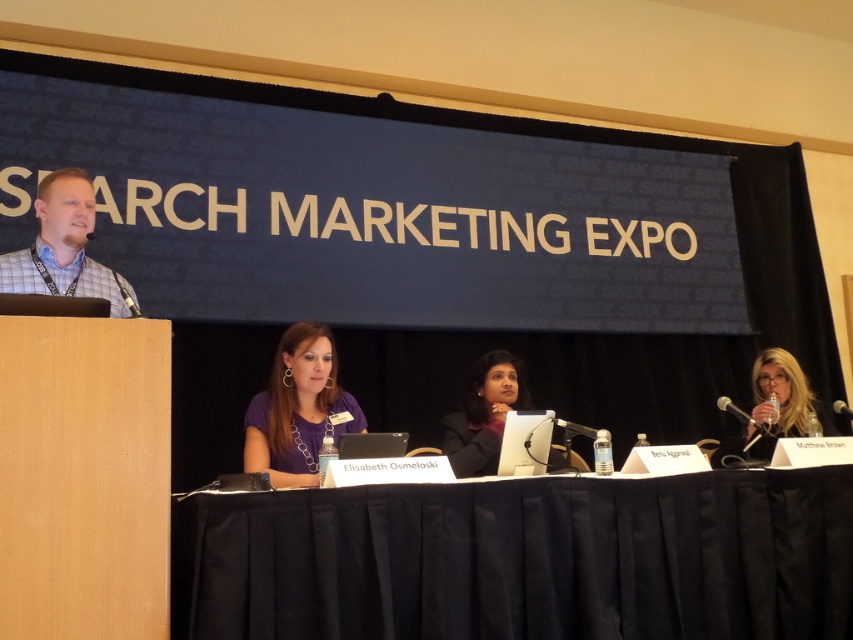
Which is more to the left, black fabric table at lower center or matte purple shirt at center?

matte purple shirt at center

Which is in front, point (532, 531) or point (491, 385)?

Point (532, 531) is more forward.

Image resolution: width=853 pixels, height=640 pixels. I want to click on black fabric table at lower center, so click(521, 560).

Does purple fabric shirt at center have a lesser width compared to matte blonde hair at right?

Correct, purple fabric shirt at center's width is less than matte blonde hair at right's.

Who is more forward, (279, 353) or (788, 433)?

Positioned in front is point (279, 353).

Locate an element on the screen. Image resolution: width=853 pixels, height=640 pixels. purple fabric shirt at center is located at coordinates (299, 408).

Does purple fabric shirt at center have a lesser height compared to black plastic microphone at upper right?

Incorrect, purple fabric shirt at center's height does not fall short of black plastic microphone at upper right's.

Is purple fabric shirt at center smaller than black plastic microphone at upper right?

No.

Between point (299, 451) and point (849, 416), which one is positioned in front?

Positioned in front is point (299, 451).

What are the coordinates of `purple fabric shirt at center` in the screenshot? It's located at (299, 408).